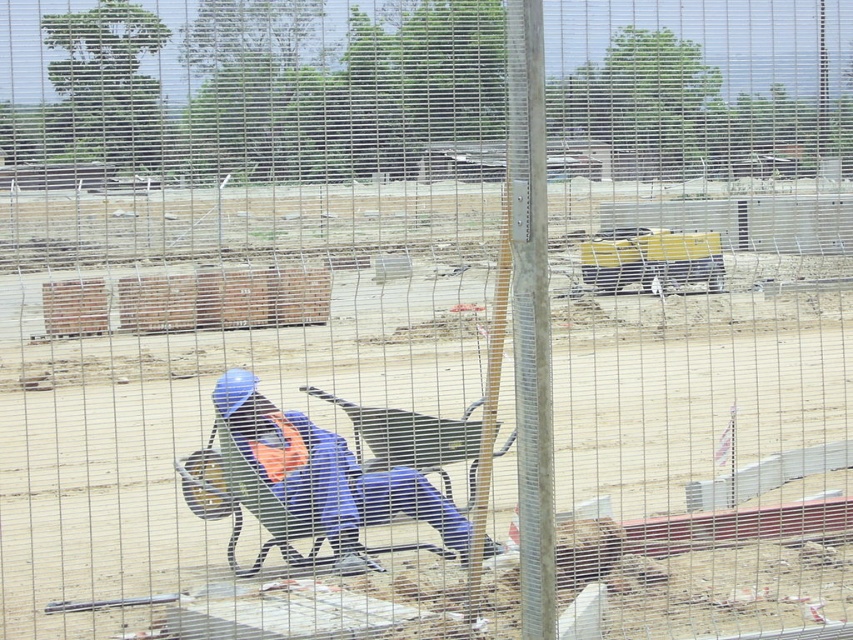
How distant is blue hard hat at center from orange fabric safety vest at center?

blue hard hat at center is 6.76 inches from orange fabric safety vest at center.

Does blue hard hat at center appear under orange fabric safety vest at center?

Yes.

Where is `blue hard hat at center`? The height and width of the screenshot is (640, 853). blue hard hat at center is located at coordinates (315, 480).

The width and height of the screenshot is (853, 640). Identify the location of blue hard hat at center. (315, 480).